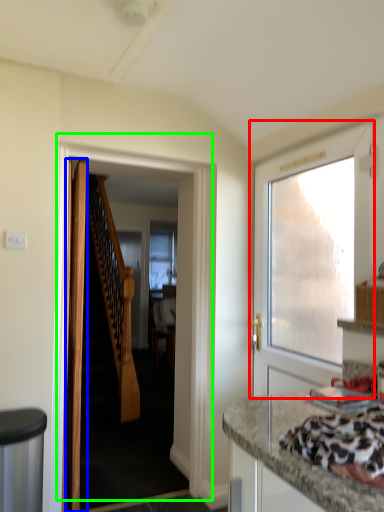
Question: Which is farther away from door (highlighted by a red box)? door (highlighted by a blue box) or door (highlighted by a green box)?

Choices:
 (A) door
 (B) door

Answer: (A)